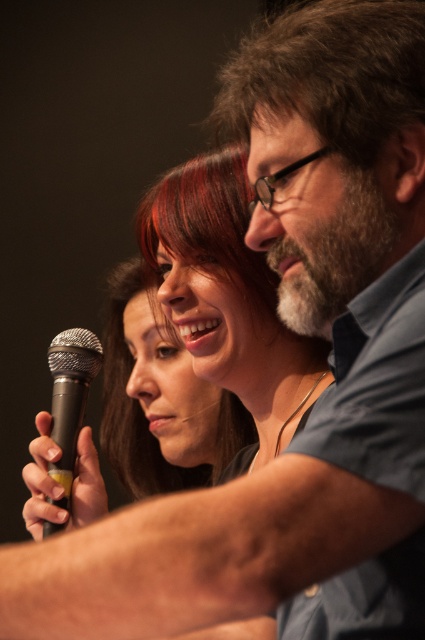
Question: Observing the image, what is the correct spatial positioning of matte black microphone at center in reference to black matte microphone at center-left?

Choices:
 (A) above
 (B) below

Answer: (A)

Question: Which point is farther to the camera?

Choices:
 (A) black matte microphone at center-left
 (B) matte black microphone at center

Answer: (B)

Question: Which of the following is the closest to the observer?

Choices:
 (A) black matte microphone at center-left
 (B) matte black microphone at center

Answer: (A)

Question: Which point is closer to the camera taking this photo?

Choices:
 (A) (113, 282)
 (B) (57, 442)

Answer: (B)

Question: In this image, where is matte black microphone at center located relative to black matte microphone at center-left?

Choices:
 (A) above
 (B) below

Answer: (A)

Question: Is matte black microphone at center below black matte microphone at center-left?

Choices:
 (A) yes
 (B) no

Answer: (B)